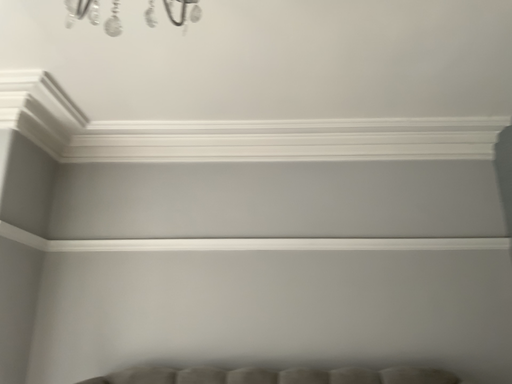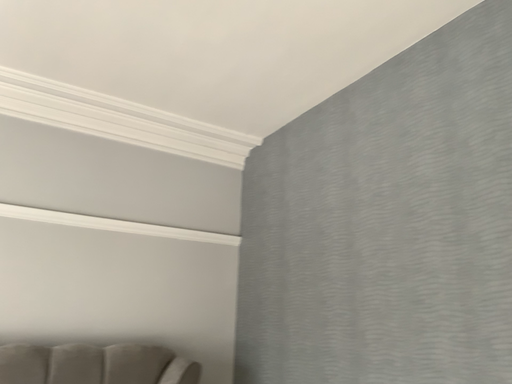
Question: Which way did the camera rotate in the video?

Choices:
 (A) rotated left
 (B) rotated right

Answer: (B)